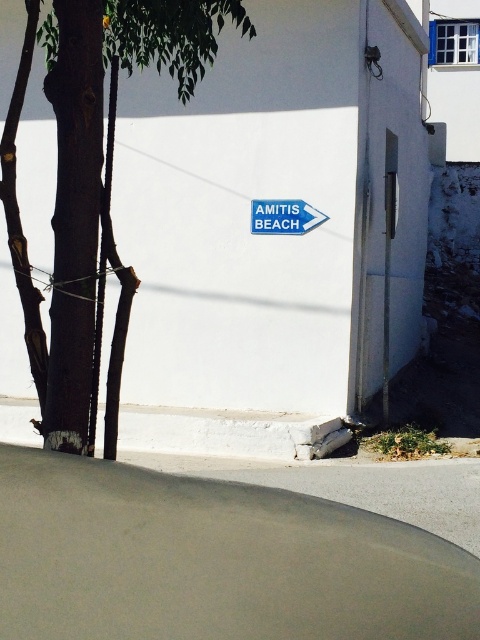
Does brown rough bark at left have a lesser height compared to blue plastic sign at center?

No.

Which is behind, point (86, 134) or point (300, 218)?

Positioned behind is point (300, 218).

Locate an element on the screen. This screenshot has width=480, height=640. brown rough bark at left is located at coordinates (92, 182).